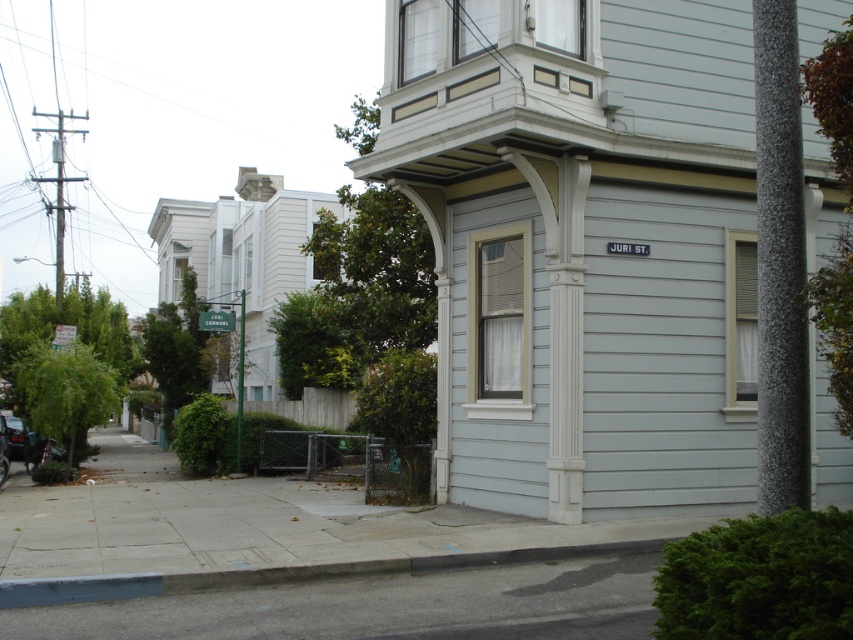
You are a pedestrian standing on the sidewalk in front of the house. You see a gray speckled pole at right and a shiny black car at lower left. Which object is closer to you?

The gray speckled pole at right is closer to the viewer than the shiny black car at lower left.

You are a delivery person trying to park your 1.2 meter wide delivery cart between the gray speckled pole at right and the gray concrete curb at lower center. Can you fit your cart between them?

The gray speckled pole at right is narrower than the gray concrete curb at lower center, so the 1.2 meter wide delivery cart can fit between them since the pole is not as wide as the curb.